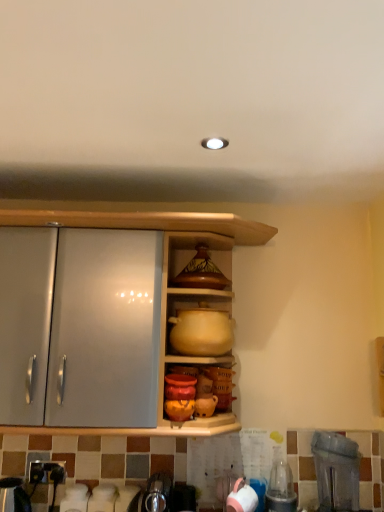
Question: Should I look upward or downward to see matte brown ceramic pot at upper center?

Choices:
 (A) down
 (B) up

Answer: (A)

Question: Is transparent plastic blender at lower right, which ranks as the first appliance in right-to-left order, at the left side of matte brown ceramic pot at upper center?

Choices:
 (A) no
 (B) yes

Answer: (A)

Question: From a real-world perspective, is transparent plastic blender at lower right, which ranks as the first appliance in right-to-left order, beneath matte brown ceramic pot at upper center?

Choices:
 (A) yes
 (B) no

Answer: (A)

Question: Can you confirm if transparent plastic blender at lower right, which is counted as the 2th appliance, starting from the left, is taller than matte brown ceramic pot at upper center?

Choices:
 (A) no
 (B) yes

Answer: (B)

Question: Considering the relative positions of transparent plastic blender at lower right, which ranks as the first appliance in right-to-left order, and matte brown ceramic pot at upper center in the image provided, is transparent plastic blender at lower right, which ranks as the first appliance in right-to-left order, in front of matte brown ceramic pot at upper center?

Choices:
 (A) no
 (B) yes

Answer: (B)

Question: Does transparent plastic blender at lower right, which is counted as the 2th appliance, starting from the left, have a lesser height compared to matte brown ceramic pot at upper center?

Choices:
 (A) no
 (B) yes

Answer: (A)

Question: Is transparent plastic blender at lower right, which is counted as the 2th appliance, starting from the left, completely or partially outside of matte brown ceramic pot at upper center?

Choices:
 (A) no
 (B) yes

Answer: (B)

Question: Considering the relative sizes of transparent plastic blender at lower right, which is counted as the 2th appliance, starting from the left, and matte yellow clay pot at center in the image provided, is transparent plastic blender at lower right, which is counted as the 2th appliance, starting from the left, taller than matte yellow clay pot at center?

Choices:
 (A) no
 (B) yes

Answer: (B)

Question: Considering the relative positions of transparent plastic blender at lower right, which ranks as the first appliance in right-to-left order, and matte yellow clay pot at center in the image provided, is transparent plastic blender at lower right, which ranks as the first appliance in right-to-left order, behind matte yellow clay pot at center?

Choices:
 (A) yes
 (B) no

Answer: (B)

Question: Is transparent plastic blender at lower right, which is counted as the 2th appliance, starting from the left, outside matte yellow clay pot at center?

Choices:
 (A) yes
 (B) no

Answer: (A)

Question: Is transparent plastic blender at lower right, which is counted as the 2th appliance, starting from the left, at the left side of matte yellow clay pot at center?

Choices:
 (A) yes
 (B) no

Answer: (B)

Question: Is matte yellow clay pot at center inside transparent plastic blender at lower right, which is counted as the 2th appliance, starting from the left?

Choices:
 (A) yes
 (B) no

Answer: (B)

Question: From a real-world perspective, is transparent plastic blender at lower right, which ranks as the first appliance in right-to-left order, located beneath matte yellow clay pot at center?

Choices:
 (A) no
 (B) yes

Answer: (B)

Question: Are matte brown ceramic pot at upper center and transparent plastic blender at lower right, which is counted as the 2th appliance, starting from the left, beside each other?

Choices:
 (A) yes
 (B) no

Answer: (B)